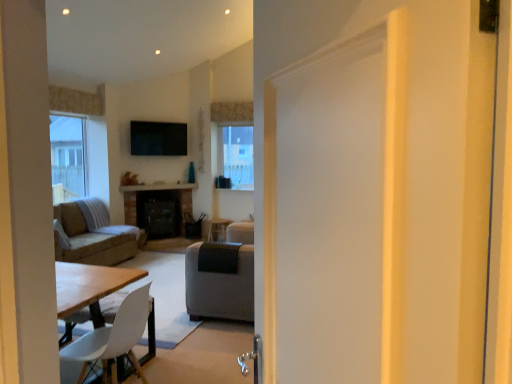
Question: Considering the positions of point (134, 312) and point (128, 244), is point (134, 312) closer or farther from the camera than point (128, 244)?

Choices:
 (A) closer
 (B) farther

Answer: (A)

Question: From the image's perspective, is white matte chair at lower left positioned above or below soft gray fabric couch at left?

Choices:
 (A) above
 (B) below

Answer: (B)

Question: Visually, is white matte chair at lower left positioned to the left or to the right of soft gray fabric couch at left?

Choices:
 (A) left
 (B) right

Answer: (B)

Question: Considering the positions of soft gray fabric couch at left and white matte chair at lower left in the image, is soft gray fabric couch at left taller or shorter than white matte chair at lower left?

Choices:
 (A) short
 (B) tall

Answer: (A)

Question: Is soft gray fabric couch at left inside or outside of white matte chair at lower left?

Choices:
 (A) inside
 (B) outside

Answer: (B)

Question: From the image's perspective, is soft gray fabric couch at left positioned above or below white matte chair at lower left?

Choices:
 (A) below
 (B) above

Answer: (B)

Question: Is soft gray fabric couch at left to the left or to the right of white matte chair at lower left in the image?

Choices:
 (A) left
 (B) right

Answer: (A)